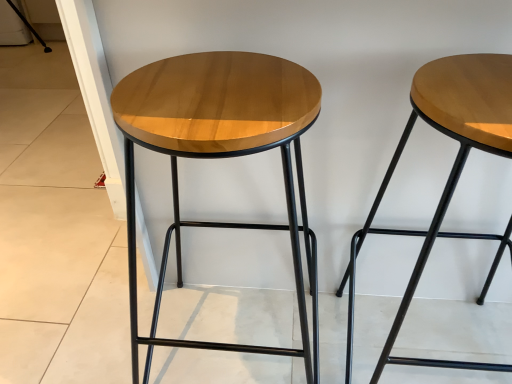
The width and height of the screenshot is (512, 384). Identify the location of vacant space that's between wooden stool at center, arranged as the first stool when viewed from the left, and wooden stool at upper right, acting as the 2th stool starting from the left. tap(329, 334).